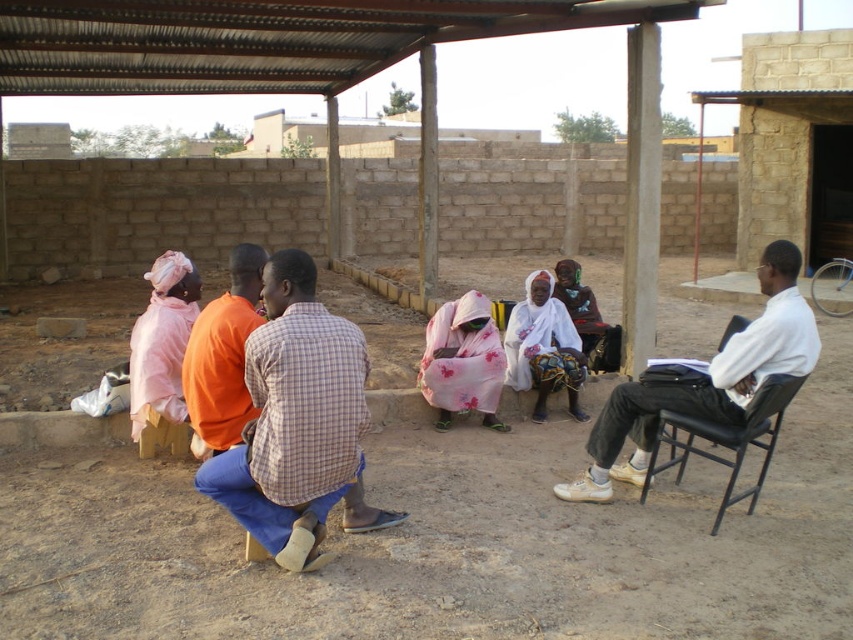
Consider the image. Is checkered fabric shirt at center above pink floral fabric at center?

No.

Which of these two, checkered fabric shirt at center or pink floral fabric at center, stands shorter?

pink floral fabric at center

Describe the element at coordinates (297, 422) in the screenshot. I see `checkered fabric shirt at center` at that location.

Locate an element on the screen. checkered fabric shirt at center is located at coordinates (297, 422).

Who is higher up, pink floral fabric at center or black leather chair at right?

pink floral fabric at center is higher up.

Does pink floral fabric at center appear on the left side of black leather chair at right?

Yes, pink floral fabric at center is to the left of black leather chair at right.

The height and width of the screenshot is (640, 853). Identify the location of pink floral fabric at center. (462, 362).

Image resolution: width=853 pixels, height=640 pixels. In order to click on pink floral fabric at center in this screenshot , I will do `click(462, 362)`.

Which is in front, point (337, 426) or point (160, 355)?

Point (337, 426) is more forward.

Does checkered fabric shirt at center have a larger size compared to pink fabric headscarf at left?

Yes, checkered fabric shirt at center is bigger than pink fabric headscarf at left.

The height and width of the screenshot is (640, 853). I want to click on checkered fabric shirt at center, so click(297, 422).